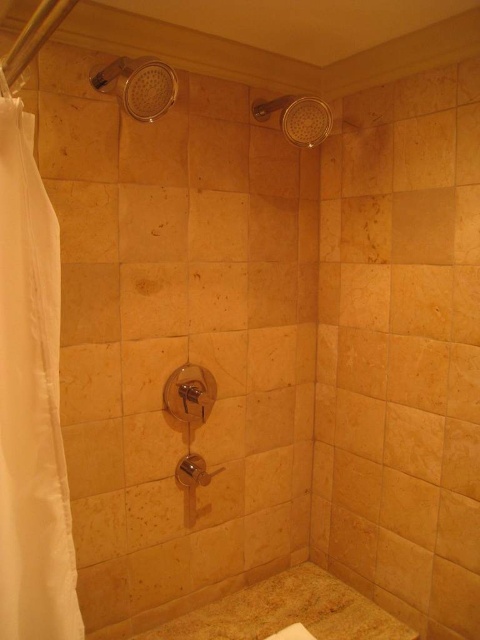
You are standing in the shower area and want to reach the clear plastic showerhead at upper center to adjust the water flow. However, the matte stone bathtub at lower center is blocking your path. Can you still reach the showerhead without moving the bathtub?

The clear plastic showerhead at upper center is behind the matte stone bathtub at lower center, so you cannot reach it directly without moving the bathtub.

You are standing in the shower area and need to reach both the point at point (x=110, y=65) and the shower control panel. If your arm can extend 4 feet, can you comfortably reach both from your current position?

The distance between the point at point (x=110, y=65) and the shower control panel is 4.40 feet. Since your arm can only extend 4 feet, you cannot comfortably reach both from your current position as the distance exceeds your arm length.

What is the position of the white fabric shower curtain at left in the shower area?

The white fabric shower curtain at left is located at point (x=31, y=403) in the shower area.